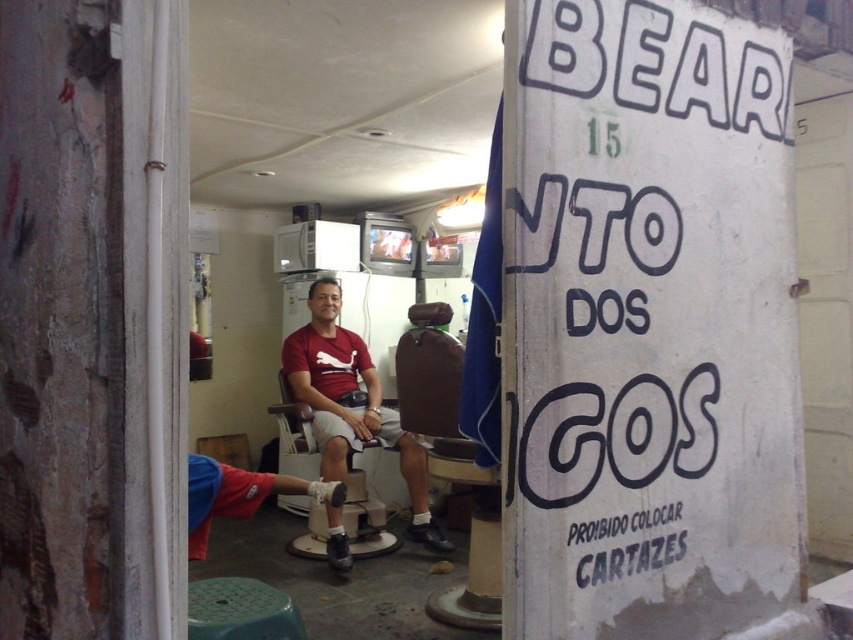
Between matte plastic chair at center and brown leather chair at center, which one appears on the left side from the viewer's perspective?

From the viewer's perspective, matte plastic chair at center appears more on the left side.

Where is `matte plastic chair at center`? Image resolution: width=853 pixels, height=640 pixels. matte plastic chair at center is located at coordinates pyautogui.click(x=366, y=508).

At what (x,y) coordinates should I click in order to perform the action: click on matte plastic chair at center. Please return your answer as a coordinate pair (x, y). This screenshot has height=640, width=853. Looking at the image, I should click on [366, 508].

Is the position of blue fabric leg at lower center more distant than that of green plastic stool at lower left?

Yes.

Who is positioned more to the left, blue fabric leg at lower center or green plastic stool at lower left?

blue fabric leg at lower center is more to the left.

Find the location of `blue fabric leg at lower center`. blue fabric leg at lower center is located at coordinates (241, 493).

Find the location of a particular element. blue fabric leg at lower center is located at coordinates (241, 493).

Can you confirm if matte red shirt at center is positioned to the left of green plastic stool at lower left?

No, matte red shirt at center is not to the left of green plastic stool at lower left.

Does point (316, 310) lie behind point (201, 579)?

Yes, it is.

The image size is (853, 640). What are the coordinates of `matte red shirt at center` in the screenshot? It's located at (351, 406).